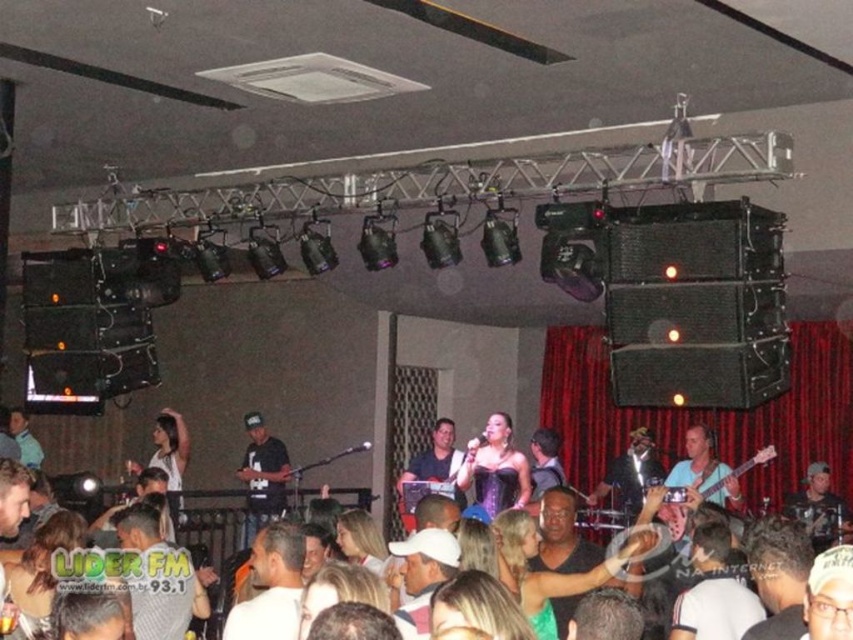
Question: Among these points, which one is nearest to the camera?

Choices:
 (A) (517, 456)
 (B) (273, 506)
 (C) (445, 456)

Answer: (A)

Question: Can you confirm if white matte shirt at center is bigger than matte black guitar at center?

Choices:
 (A) yes
 (B) no

Answer: (B)

Question: Which of the following is the farthest from the observer?

Choices:
 (A) matte black guitar at center
 (B) purple satin dress at center

Answer: (B)

Question: Which of the following is the closest to the observer?

Choices:
 (A) (263, 625)
 (B) (445, 440)
 (C) (471, 465)
 (D) (274, 467)

Answer: (A)

Question: Does white matte shirt at center have a smaller size compared to black matte shirt at center?

Choices:
 (A) yes
 (B) no

Answer: (A)

Question: Does black matte shirt at center lie in front of matte black guitar at center?

Choices:
 (A) yes
 (B) no

Answer: (B)